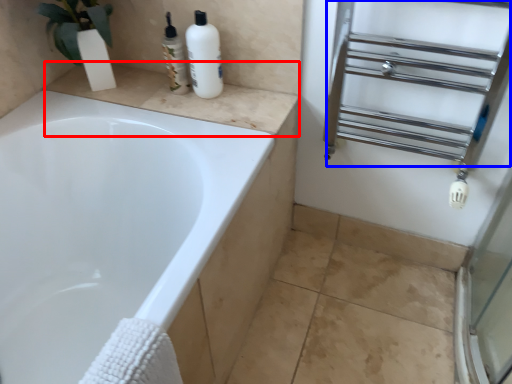
Question: Which object appears closest to the camera in this image, counter top (highlighted by a red box) or shelf (highlighted by a blue box)?

Choices:
 (A) counter top
 (B) shelf

Answer: (B)